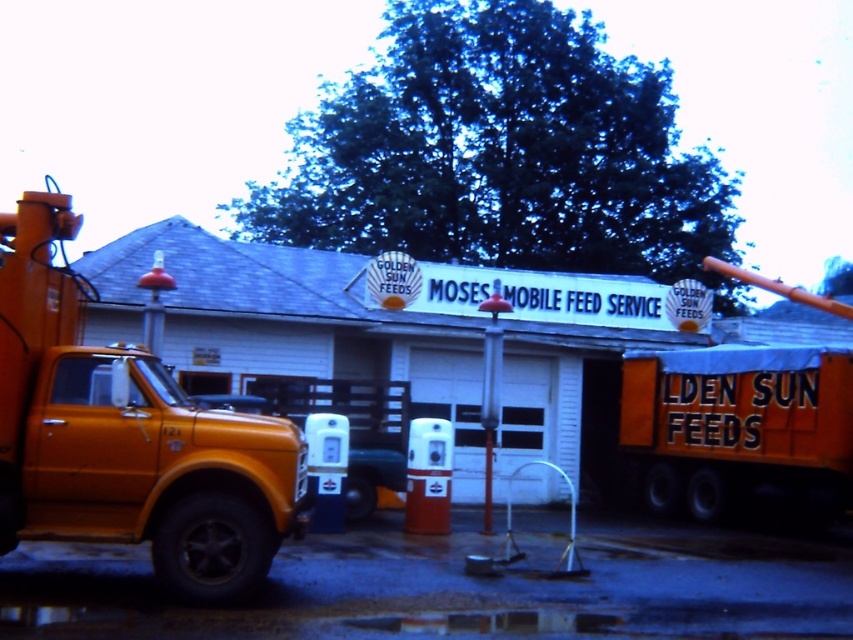
Question: Does matte orange truck at left appear on the left side of orange matte truck at center?

Choices:
 (A) yes
 (B) no

Answer: (A)

Question: Is orange matte truck at center positioned before metallic red pole at center?

Choices:
 (A) no
 (B) yes

Answer: (A)

Question: Among these objects, which one is nearest to the camera?

Choices:
 (A) orange matte truck at center
 (B) matte orange truck at left

Answer: (B)

Question: Which object is farther from the camera taking this photo?

Choices:
 (A) metallic red pole at center
 (B) orange matte truck at center
 (C) matte orange truck at left

Answer: (B)

Question: Which object is closer to the camera taking this photo?

Choices:
 (A) orange matte truck at center
 (B) metallic red pole at center
 (C) matte orange truck at left

Answer: (C)

Question: Is matte orange truck at left above metallic red pole at center?

Choices:
 (A) yes
 (B) no

Answer: (B)